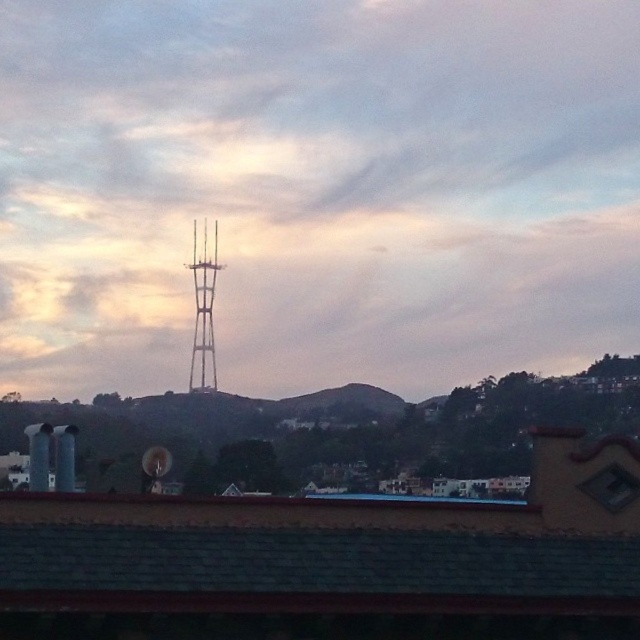
Question: Can you confirm if green grassy hill at center is smaller than metallic tower at center?

Choices:
 (A) no
 (B) yes

Answer: (B)

Question: Which point is farther to the camera?

Choices:
 (A) (392, 396)
 (B) (163, 152)
 (C) (209, 308)

Answer: (B)

Question: Which object is the closest to the metallic tower at center?

Choices:
 (A) white fluffy cloud at upper center
 (B) green grassy hill at center

Answer: (B)

Question: Does white fluffy cloud at upper center come in front of metallic tower at center?

Choices:
 (A) no
 (B) yes

Answer: (A)

Question: Can you confirm if white fluffy cloud at upper center is smaller than green grassy hill at center?

Choices:
 (A) yes
 (B) no

Answer: (B)

Question: Which of these objects is positioned closest to the white fluffy cloud at upper center?

Choices:
 (A) metallic tower at center
 (B) green grassy hill at center

Answer: (A)